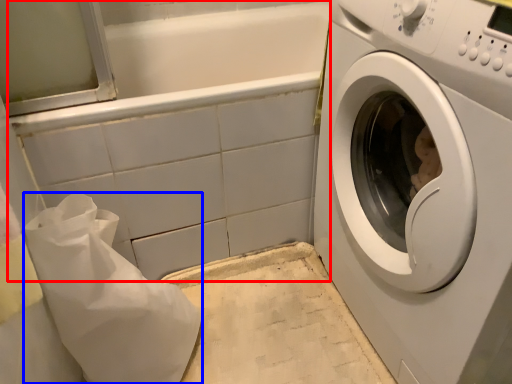
Question: Which object appears closest to the camera in this image, bath (highlighted by a red box) or material (highlighted by a blue box)?

Choices:
 (A) bath
 (B) material

Answer: (B)